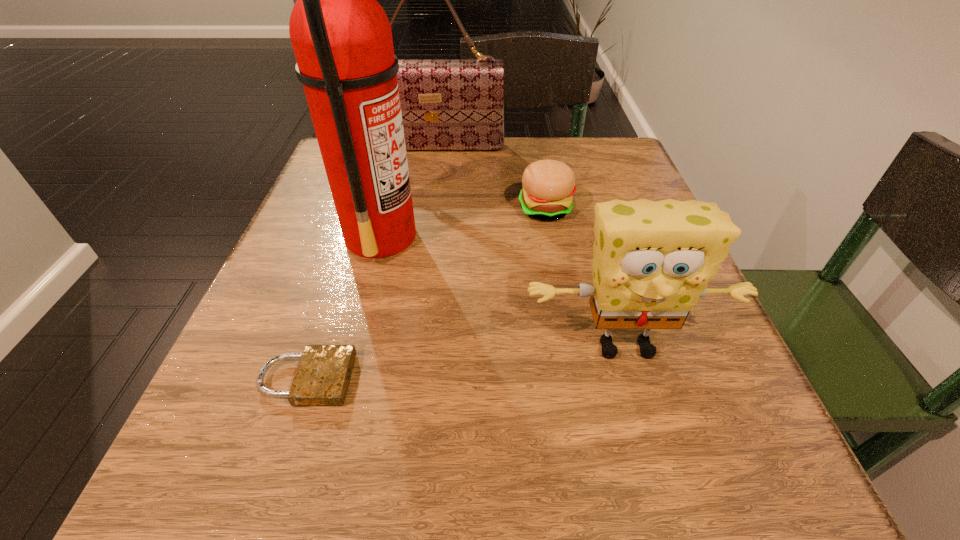
Locate an element on the screen. This screenshot has width=960, height=540. free space located 0.250m on the keyhole side of the padlock is located at coordinates (543, 379).

Identify the location of handbag positioned at the far edge. Image resolution: width=960 pixels, height=540 pixels. point(446,104).

Locate an element on the screen. hamburger that is positioned at the far edge is located at coordinates (548, 185).

At what (x,y) coordinates should I click in order to perform the action: click on fire extinguisher present at the left edge. Please return your answer as a coordinate pair (x, y). The height and width of the screenshot is (540, 960). Looking at the image, I should click on (342, 40).

Find the location of `handbag at the left edge`. handbag at the left edge is located at coordinates (446, 104).

At what (x,y) coordinates should I click in order to perform the action: click on padlock that is at the left edge. Please return your answer as a coordinate pair (x, y). The image size is (960, 540). Looking at the image, I should click on (322, 378).

Where is `sponge that is at the right edge`? Image resolution: width=960 pixels, height=540 pixels. sponge that is at the right edge is located at coordinates pos(652,262).

In order to click on hamburger at the right edge in this screenshot , I will do `click(548, 185)`.

Find the location of a particular element. This screenshot has height=540, width=960. object that is at the far left corner is located at coordinates (446, 104).

Where is `object that is at the far right corner`? This screenshot has height=540, width=960. object that is at the far right corner is located at coordinates point(548,185).